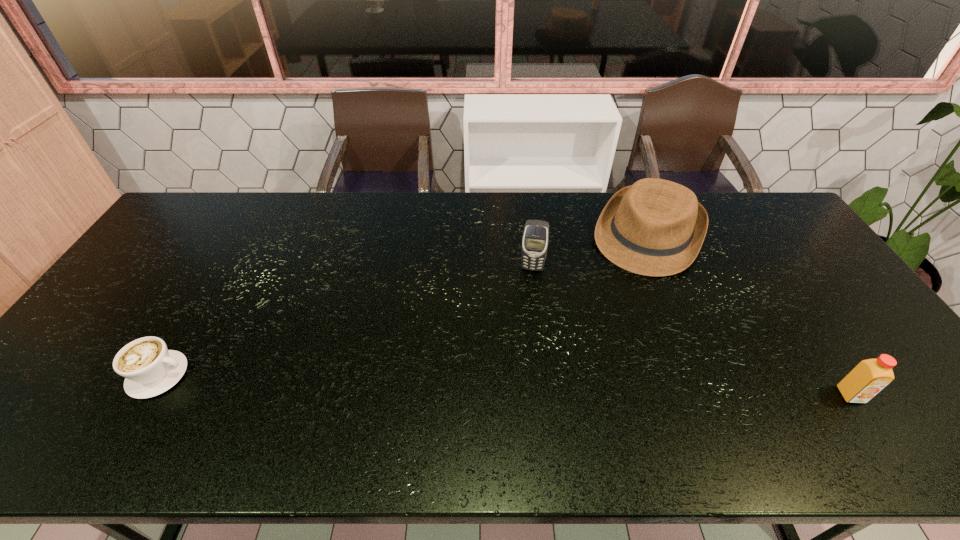
What are the coordinates of `vacant spot on the desktop that is between the leftmost object and the rightmost object and is positioned on the front face of the cellular telephone` in the screenshot? It's located at (519, 385).

At what (x,y) coordinates should I click in order to perform the action: click on vacant space on the desktop that is between the shortest object and the orange juice and is positioned on the front-facing side of the fedora. Please return your answer as a coordinate pair (x, y). Looking at the image, I should click on (571, 387).